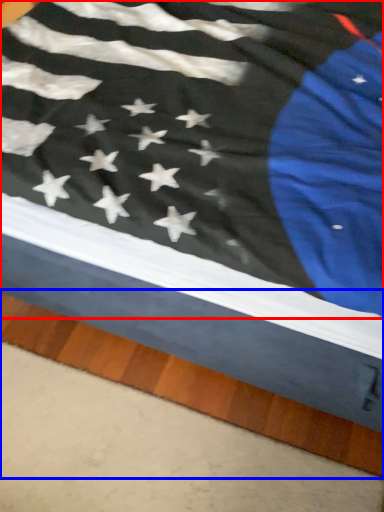
Question: Which point is further to the camera, flag (highlighted by a red box) or plank (highlighted by a blue box)?

Choices:
 (A) flag
 (B) plank

Answer: (B)